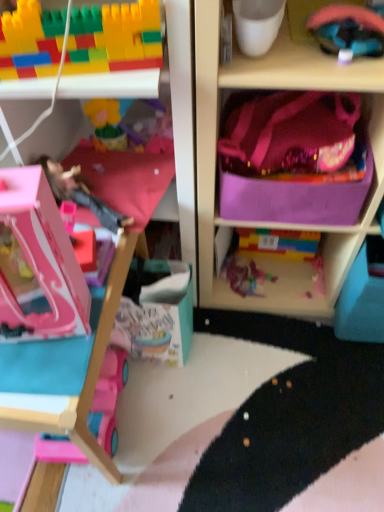
This screenshot has height=512, width=384. I want to click on vacant area that is situated to the right of translucent plastic toy at center, acting as the second toy starting from the bottom, so click(x=300, y=285).